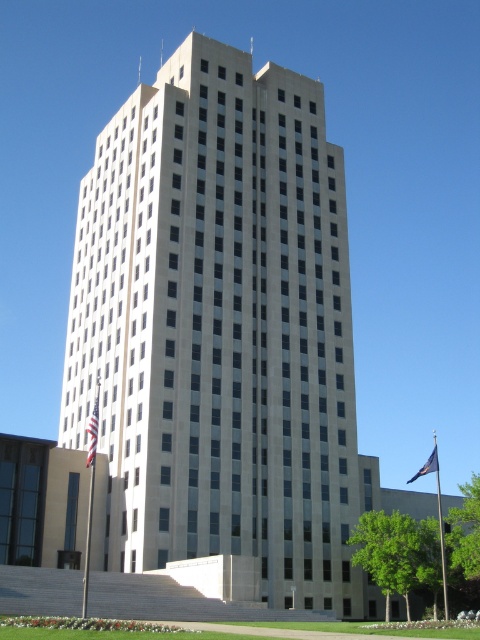
You are a photographer planning to capture the beige concrete tower at center and the blue fabric flag at lower right in a single frame. Based on their sizes, which object will appear larger in the photo?

The beige concrete tower at center will appear larger in the photo since its width surpasses that of the blue fabric flag at lower right.

You are standing in front of the building and want to take a photo. There are two points marked in the image, point (120,528) and point (428,461). Which point is closer to your current position?

Point (120,528) is closer to the camera than point (428,461), so the point (120,528) is closer to your current position.

Based on the scene description, where is the beige concrete tower at center located in terms of its 2D coordinates?

The beige concrete tower at center is located at the 2D coordinates point (220, 328).